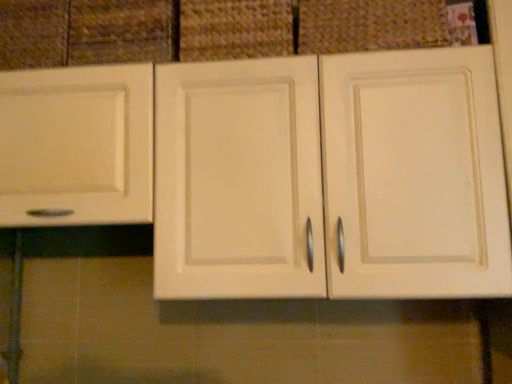
Question: Which direction should I rotate to look at matte fabric basket at upper center, which is the second basket in left-to-right order, — up or down?

Choices:
 (A) down
 (B) up

Answer: (B)

Question: From the image's perspective, is woven fabric basket at upper center, the first basket when ordered from left to right, over matte white drawer at upper left?

Choices:
 (A) yes
 (B) no

Answer: (A)

Question: Does woven fabric basket at upper center, the first basket when ordered from left to right, have a lesser width compared to matte white drawer at upper left?

Choices:
 (A) no
 (B) yes

Answer: (B)

Question: Is woven fabric basket at upper center, the first basket when ordered from left to right, directly adjacent to matte white drawer at upper left?

Choices:
 (A) no
 (B) yes

Answer: (A)

Question: Is woven fabric basket at upper center, the first basket when ordered from left to right, smaller than matte white drawer at upper left?

Choices:
 (A) no
 (B) yes

Answer: (B)

Question: Is woven fabric basket at upper center, which is counted as the second basket, starting from the right, positioned far away from matte white drawer at upper left?

Choices:
 (A) yes
 (B) no

Answer: (B)

Question: Is woven fabric basket at upper center, the first basket when ordered from left to right, shorter than matte white drawer at upper left?

Choices:
 (A) yes
 (B) no

Answer: (A)

Question: From the image's perspective, is matte cream cabinet at center located above matte fabric basket at upper center, which appears as the 1th basket when viewed from the right?

Choices:
 (A) no
 (B) yes

Answer: (A)

Question: Is matte cream cabinet at center next to matte fabric basket at upper center, which is the second basket in left-to-right order, and touching it?

Choices:
 (A) yes
 (B) no

Answer: (B)

Question: Considering the relative positions of matte cream cabinet at center and matte fabric basket at upper center, which appears as the 1th basket when viewed from the right, in the image provided, is matte cream cabinet at center behind matte fabric basket at upper center, which appears as the 1th basket when viewed from the right,?

Choices:
 (A) yes
 (B) no

Answer: (B)

Question: Does matte cream cabinet at center appear on the left side of matte fabric basket at upper center, which is the second basket in left-to-right order?

Choices:
 (A) no
 (B) yes

Answer: (B)

Question: From a real-world perspective, does matte cream cabinet at center sit lower than matte fabric basket at upper center, which is the second basket in left-to-right order?

Choices:
 (A) yes
 (B) no

Answer: (A)

Question: Does matte cream cabinet at center have a lesser width compared to matte fabric basket at upper center, which is the second basket in left-to-right order?

Choices:
 (A) yes
 (B) no

Answer: (B)

Question: From the image's perspective, is matte white drawer at upper left on matte fabric basket at upper center, which is the second basket in left-to-right order?

Choices:
 (A) no
 (B) yes

Answer: (A)